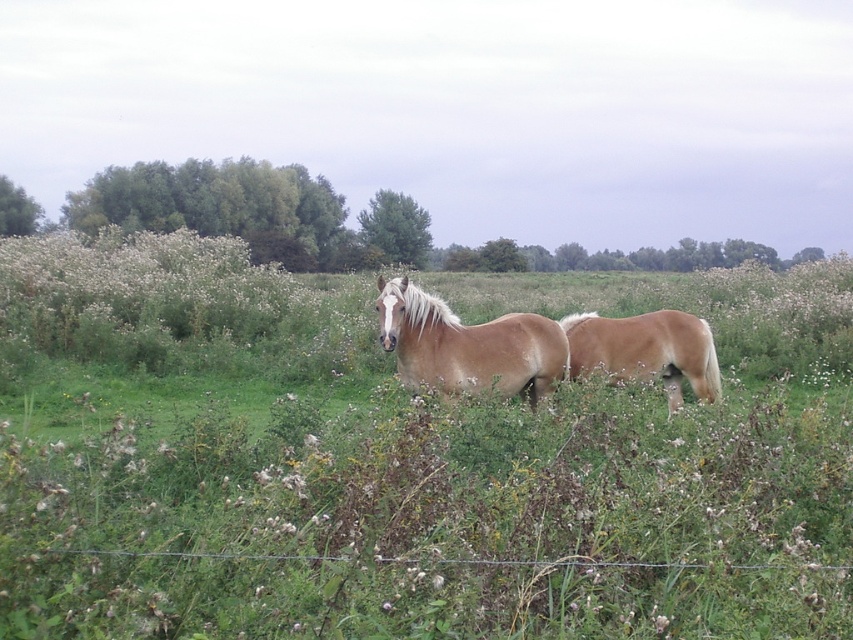
From the picture: Is brown matte horse at center above light brown horse at center?

Yes.

Can you confirm if brown matte horse at center is thinner than light brown horse at center?

Correct, brown matte horse at center's width is less than light brown horse at center's.

Which is in front, point (413, 332) or point (660, 369)?

Point (413, 332) is in front.

Locate an element on the screen. The image size is (853, 640). brown matte horse at center is located at coordinates (467, 346).